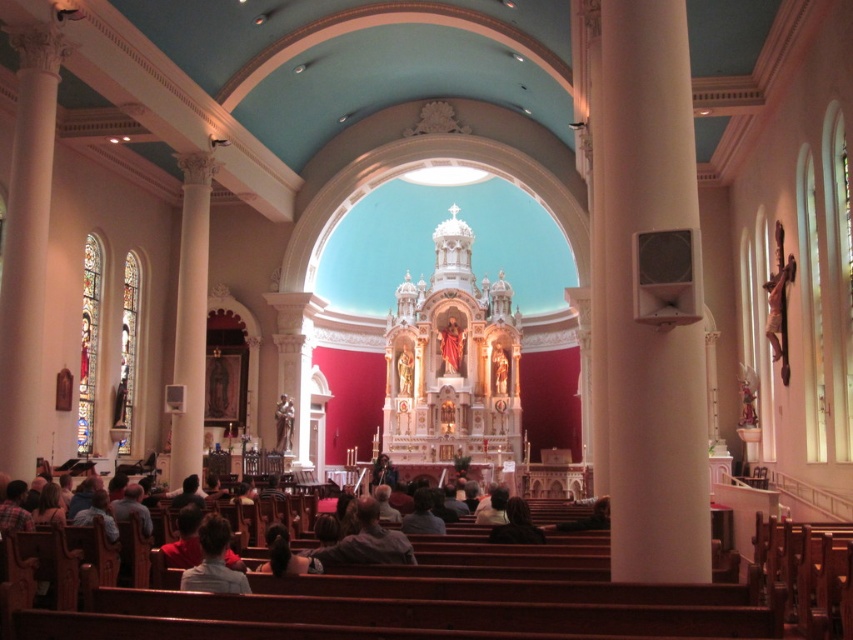
You are standing at the entrance of the grand church and notice two points marked in the image. Which of the two points, point (354,560) or point (450,321), is closer to you?

Point (354,560) is closer to the viewer than point (450,321).

You are a visitor in the church and want to place a small bouquet of flowers between the gray fabric jacket at center and the matte red statue at center. Which object should you place the bouquet closer to if you want it to be centered between them?

The gray fabric jacket at center is wider than the matte red statue at center. To center the bouquet between them, place it closer to the matte red statue at center since it is narrower, balancing the distance from both objects.

You are an interior designer assessing the layout of the church. You notice the gray fabric jacket at center and the matte red statue at center. Which object is taller when viewed from the entrance of the nave?

The matte red statue at center is taller than the gray fabric jacket at center.